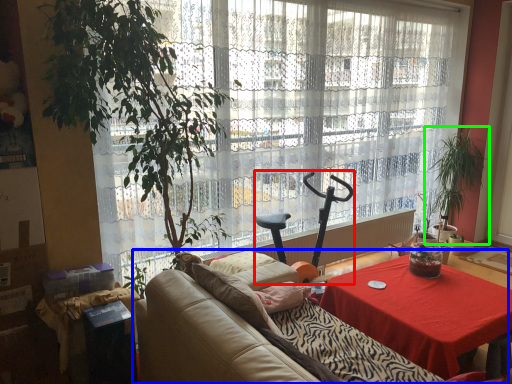
Question: Which object is the farthest from swivel chair (highlighted by a red box)? Choose among these: studio couch (highlighted by a blue box) or houseplant (highlighted by a green box).

Choices:
 (A) studio couch
 (B) houseplant

Answer: (B)